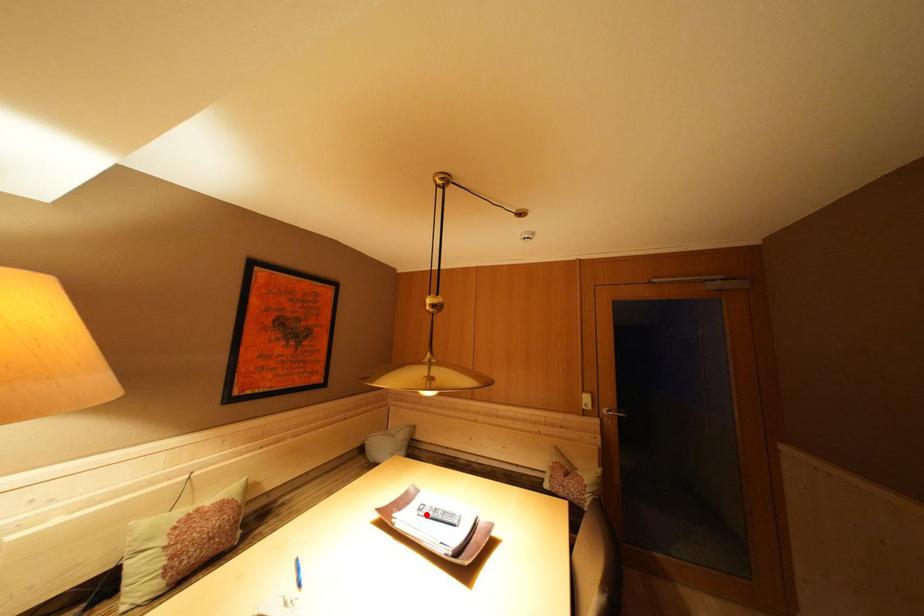
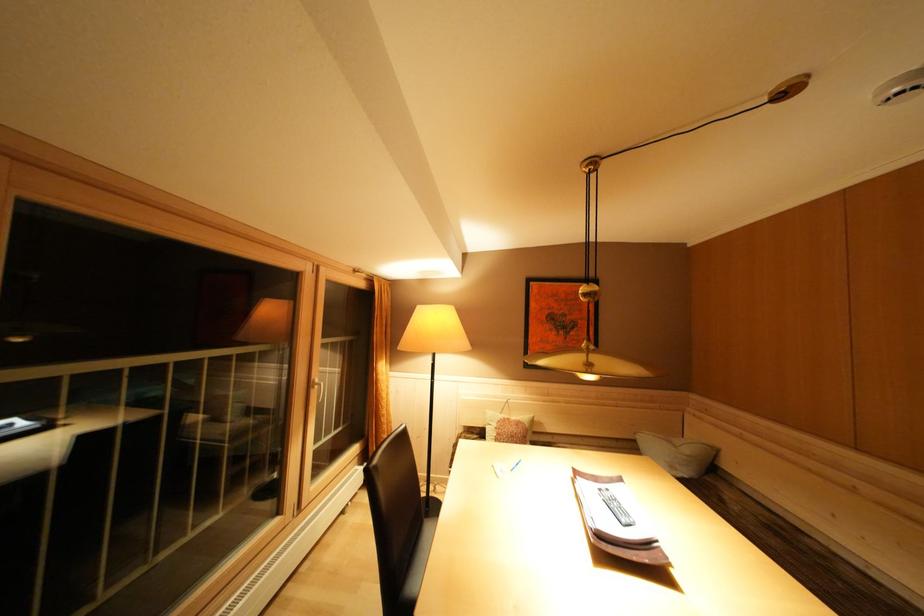
Where in the second image is the point corresponding to the highlighted location from the first image?

(608, 495)